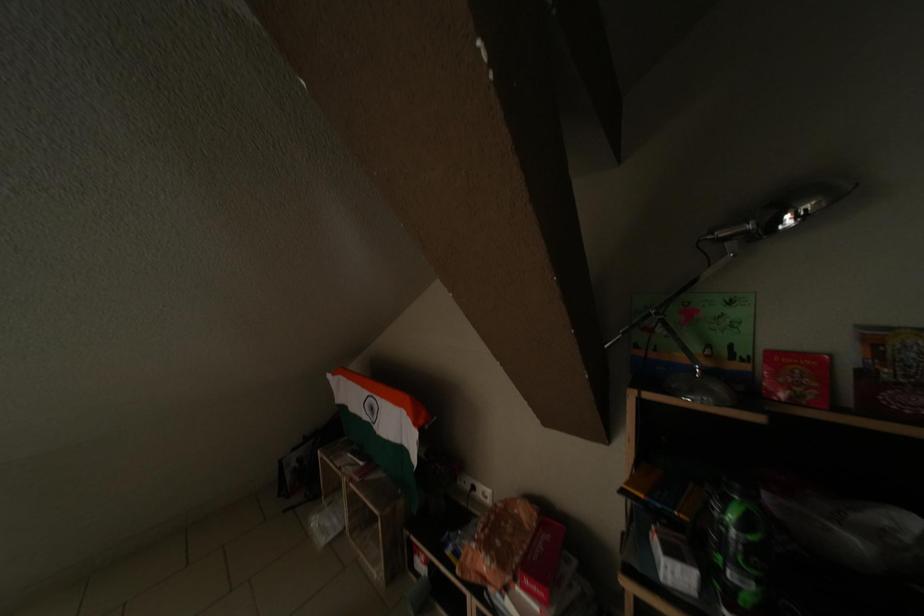
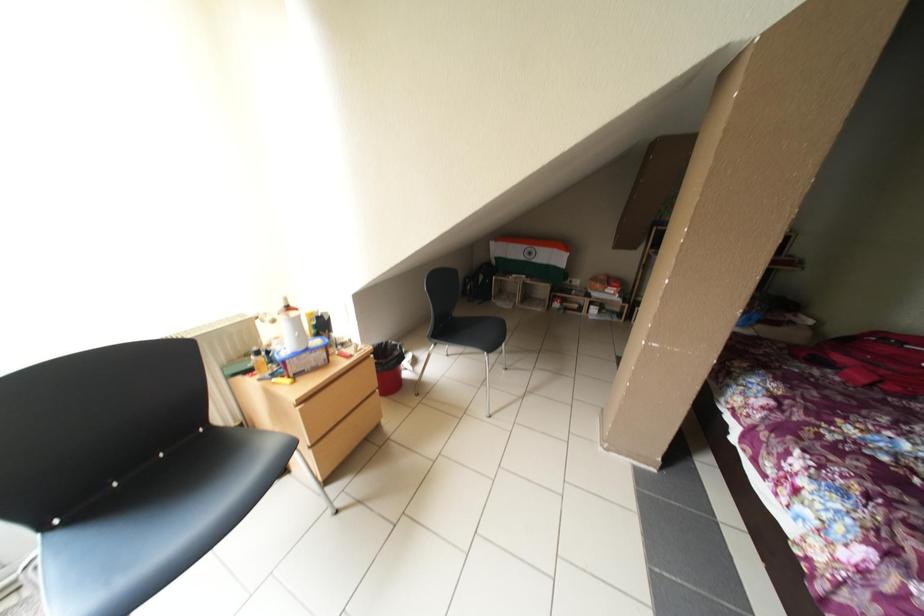
Which direction would the cameraman need to move to produce the second image?

The cameraman moved toward left, backward.